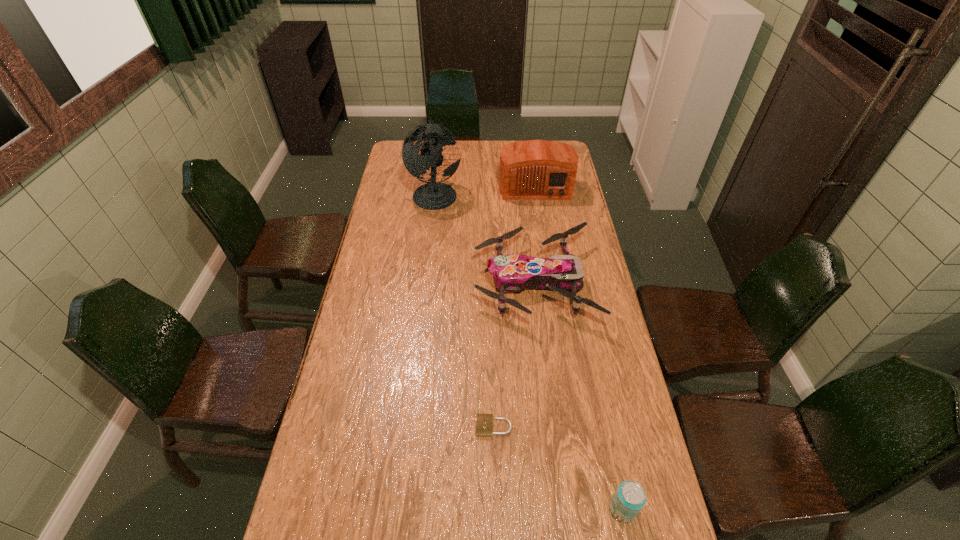
The image size is (960, 540). What are the coordinates of `vacant space that satisfies the following two spatial constraints: 1. on the front-facing side of the fourth farthest object; 2. on the left side of the leftmost object` in the screenshot? It's located at (407, 426).